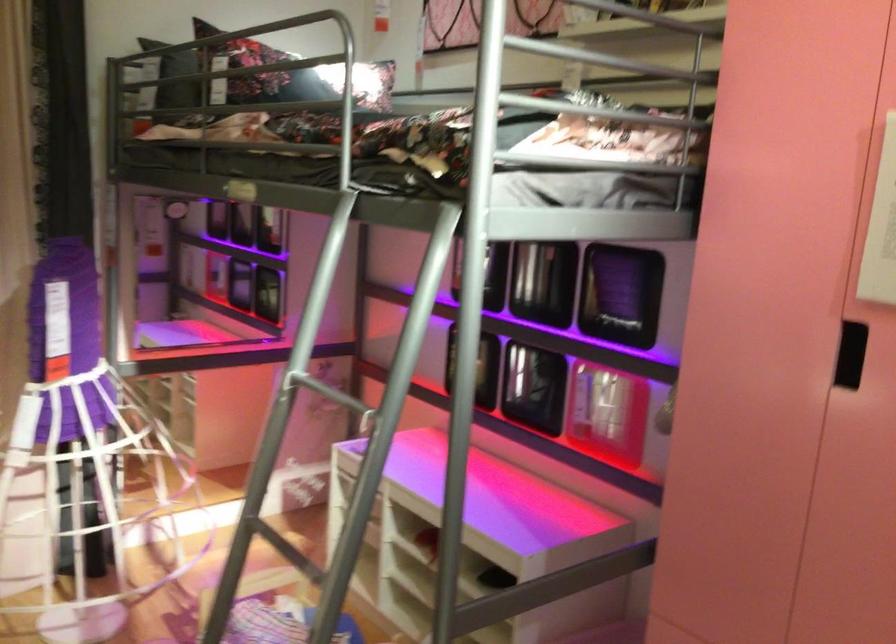
Question: Based on the continuous images, in which direction is the camera rotating? Reply with the corresponding letter.

Choices:
 (A) Left
 (B) Right
 (C) Up
 (D) Down

Answer: (A)